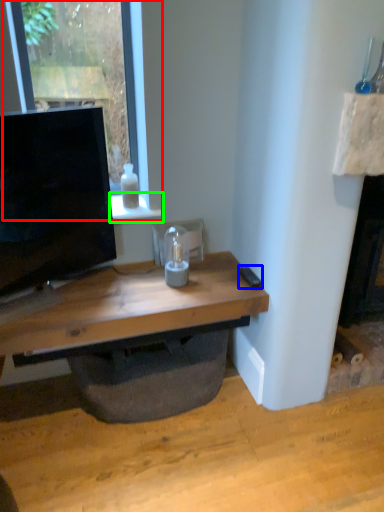
Question: Which object is positioned farthest from window (highlighted by a red box)? Select from remote control (highlighted by a blue box) and window sill (highlighted by a green box).

Choices:
 (A) remote control
 (B) window sill

Answer: (A)